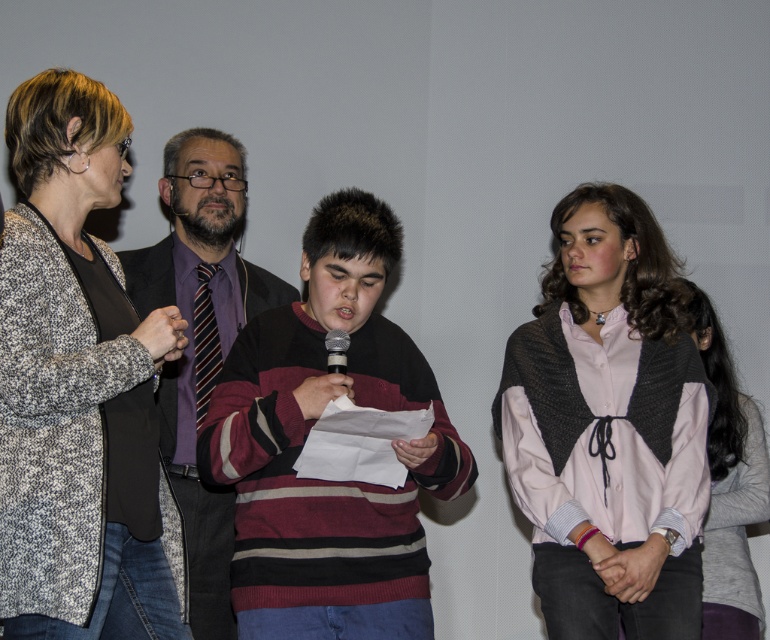
Consider the image. Can you confirm if knitted gray shawl at right is wider than gray sweater at center?

Yes.

Who is lower down, knitted gray shawl at right or gray sweater at center?

Positioned lower is gray sweater at center.

This screenshot has width=770, height=640. Describe the element at coordinates (608, 428) in the screenshot. I see `knitted gray shawl at right` at that location.

Image resolution: width=770 pixels, height=640 pixels. Identify the location of knitted gray shawl at right. (608, 428).

Can you confirm if knitted gray shawl at right is positioned to the left of maroon striped sweater at center?

No, knitted gray shawl at right is not to the left of maroon striped sweater at center.

Describe the element at coordinates (608, 428) in the screenshot. This screenshot has width=770, height=640. I see `knitted gray shawl at right` at that location.

You are a GUI agent. You are given a task and a screenshot of the screen. Output one action in this format:
    pyautogui.click(x=<x>, y=<y>)
    Task: Click on the knitted gray shawl at right
    
    Given the screenshot: What is the action you would take?
    pyautogui.click(x=608, y=428)

Can you confirm if maroon striped sweater at center is taller than striped sweater at center?

No.

Can you confirm if maroon striped sweater at center is shorter than striped sweater at center?

Yes.

Does point (417, 394) lie behind point (192, 156)?

That is False.

You are a GUI agent. You are given a task and a screenshot of the screen. Output one action in this format:
    pyautogui.click(x=<x>, y=<y>)
    Task: Click on the maroon striped sweater at center
    This screenshot has width=770, height=640.
    Given the screenshot: What is the action you would take?
    pyautogui.click(x=305, y=436)